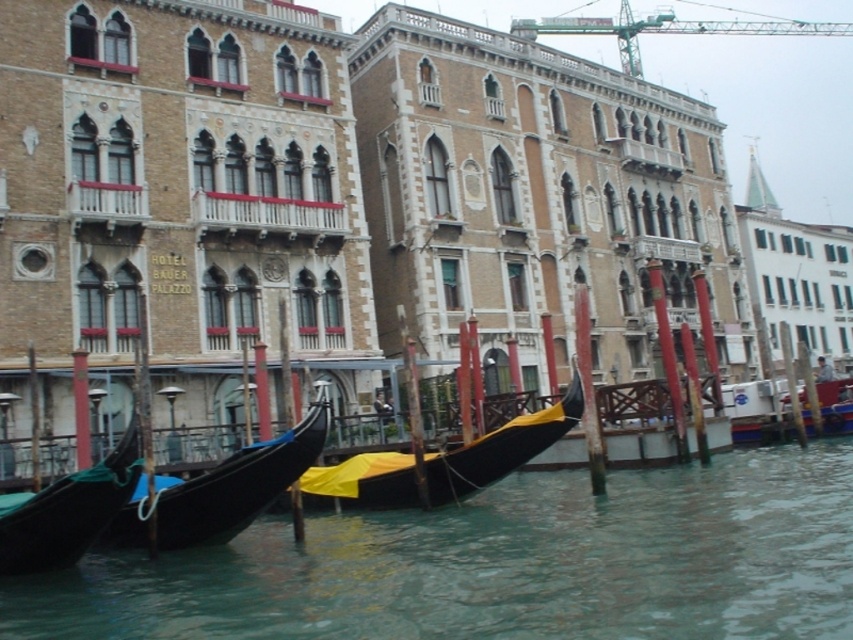
You are standing at point [531,634] and want to reach the Hotel Bauer Palazzo sign. Given that the distance between you and the sign is 30 meters, can you estimate how far you need to walk to reach it?

The distance between you and the Hotel Bauer Palazzo sign is 30.00 meters, so you need to walk 30 meters to reach it.

You are standing on the wooden post where the black glossy gondola at center is moored. You want to move to the Hotel Bauer Palazzo sign. Which direction should you go?

You should move north because the Hotel Bauer Palazzo sign is located in the background of the scene, which is north of the gondola.

You are a tour guide explaining the distance between the black glossy gondola at center and the green metallic crane at upper center to a tourist. What do you tell them?

The black glossy gondola at center is 70.76 meters away from the green metallic crane at upper center.